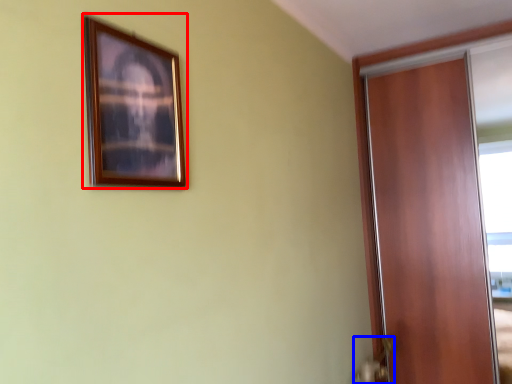
Question: Which of the following is the farthest to the observer, picture frame (highlighted by a red box) or door handle (highlighted by a blue box)?

Choices:
 (A) picture frame
 (B) door handle

Answer: (B)